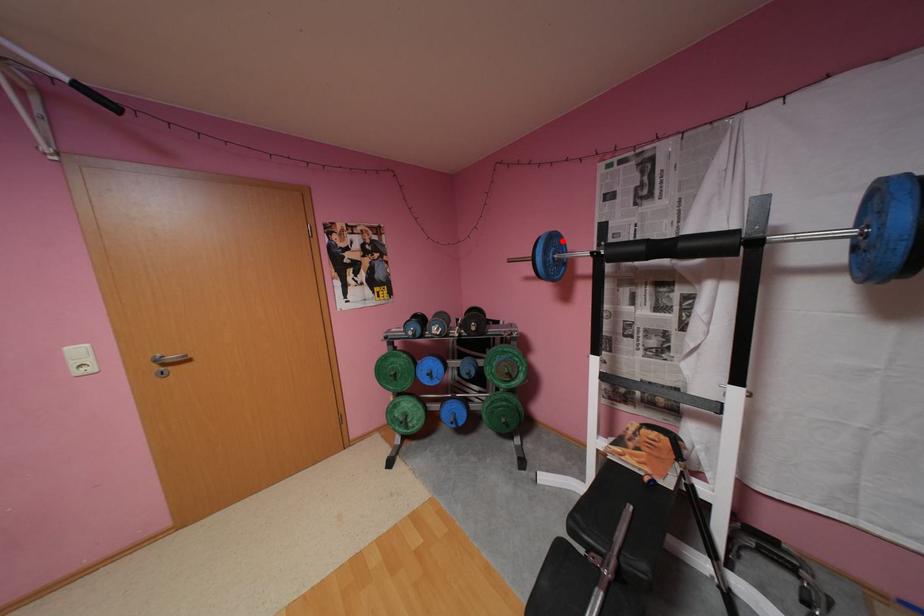
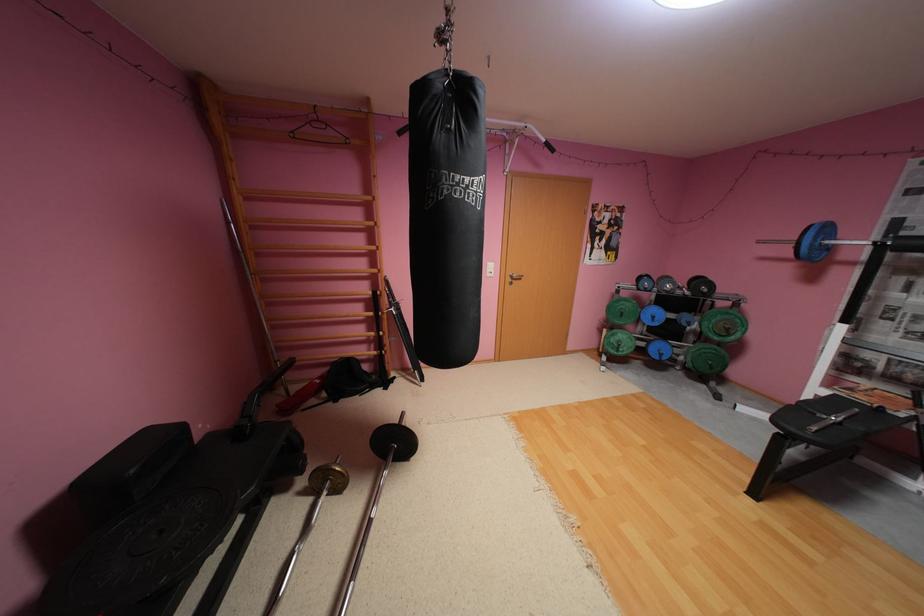
Find the pixel in the second image that matches the highlighted location in the first image.

(835, 229)